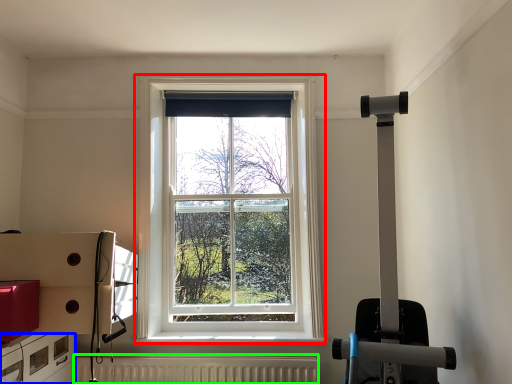
Question: Which object is positioned farthest from window (highlighted by a red box)? Select from drawer (highlighted by a blue box) and radiator (highlighted by a green box).

Choices:
 (A) drawer
 (B) radiator

Answer: (A)